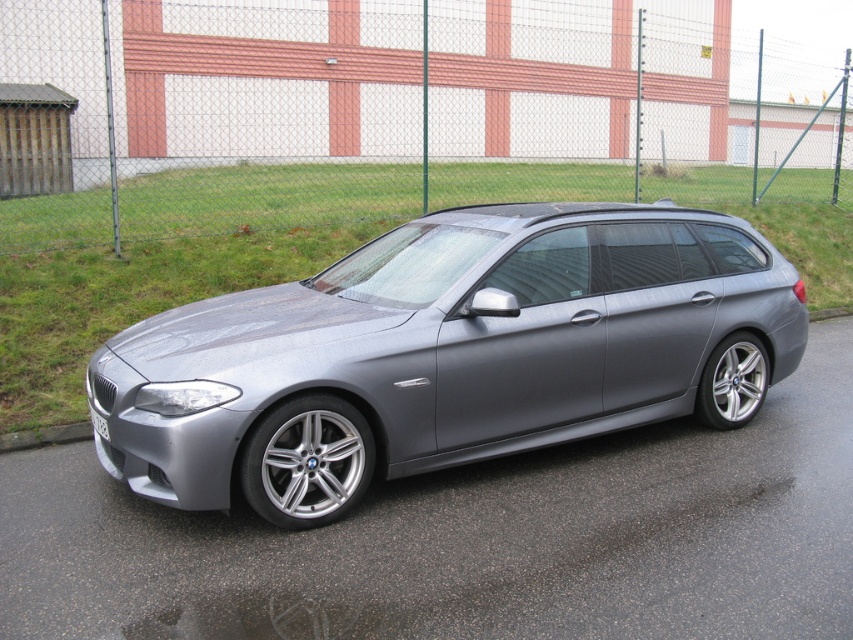
Question: Which point appears farthest from the camera in this image?

Choices:
 (A) (99, 417)
 (B) (352, 349)

Answer: (A)

Question: Which point is closer to the camera?

Choices:
 (A) [425, 426]
 (B) [94, 416]

Answer: (A)

Question: Does matte gray car at center appear under white plastic license plate at center?

Choices:
 (A) no
 (B) yes

Answer: (A)

Question: Which of the following is the closest to the observer?

Choices:
 (A) (593, 218)
 (B) (103, 429)

Answer: (B)

Question: Can you confirm if matte gray car at center is bigger than white plastic license plate at center?

Choices:
 (A) no
 (B) yes

Answer: (B)

Question: Can you confirm if matte gray car at center is positioned to the right of white plastic license plate at center?

Choices:
 (A) yes
 (B) no

Answer: (A)